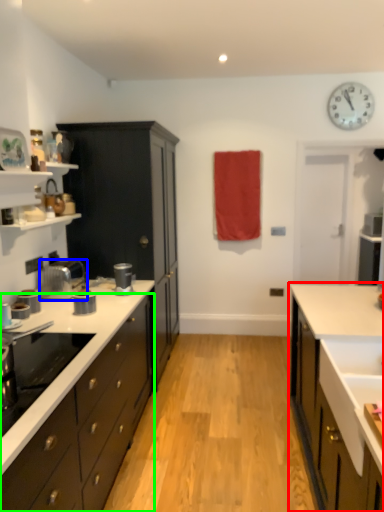
Question: Which object is positioned closest to cabinetry (highlighted by a red box)? Select from kitchen appliance (highlighted by a blue box) and cabinetry (highlighted by a green box).

Choices:
 (A) kitchen appliance
 (B) cabinetry

Answer: (B)